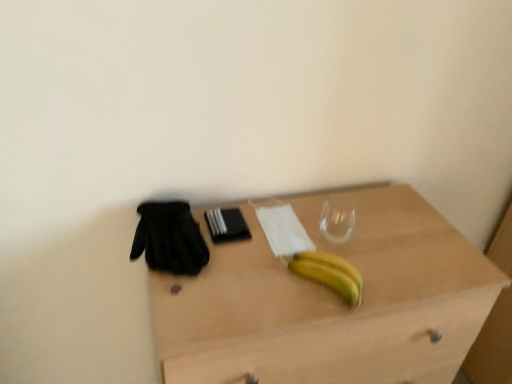
Locate an element on the screen. vacant space to the right of yellow matte banana at center is located at coordinates (395, 264).